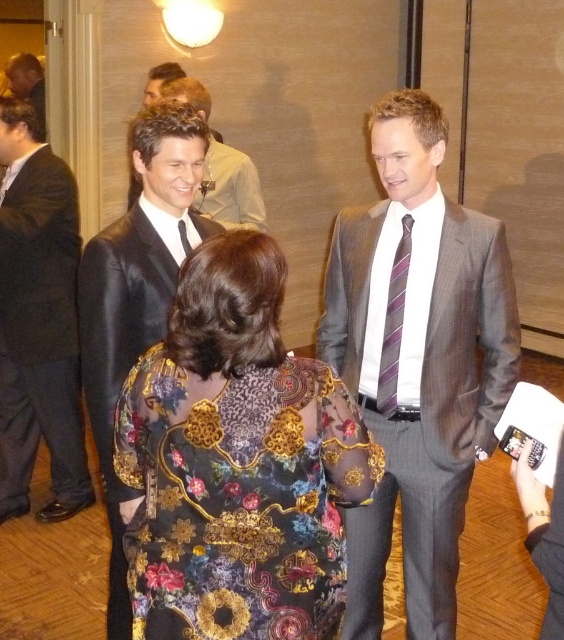
Based on the photo, you are organizing a charity event and need to decide which item to display first in the exhibition. The purple striped tie at center and the matte black suit at upper left are both candidates. Based on their sizes, which one should be placed in a smaller display case?

The purple striped tie at center has a smaller size compared to the matte black suit at upper left, so it should be placed in the smaller display case.

You are a photographer at the event and want to focus on the two points in the image. Which point, point (464, 394) or point (19, 429), is closer to your camera lens?

Point (464, 394) is closer to the camera than point (19, 429).